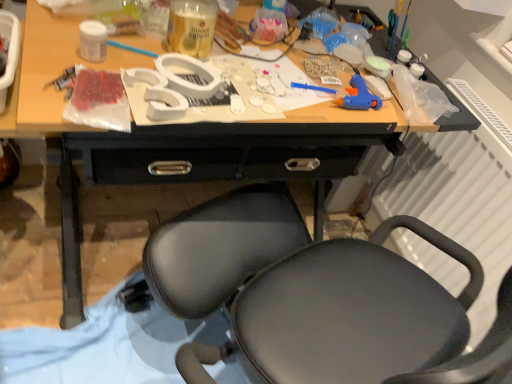
Question: Do you think translucent plastic bottle at upper center, the first bottle in the right-to-left sequence, is within black matte chair at center, or outside of it?

Choices:
 (A) inside
 (B) outside

Answer: (B)

Question: From the image's perspective, relative to black matte chair at center, is translucent plastic bottle at upper center, the first bottle in the right-to-left sequence, above or below?

Choices:
 (A) above
 (B) below

Answer: (A)

Question: Which object is the farthest from the blue plastic glue gun at right?

Choices:
 (A) white plastic radiator at right
 (B) translucent plastic bottle at upper center, positioned as the first bottle in back-to-front order
 (C) black matte chair at center
 (D) translucent glass bottle at center, the second bottle viewed from the right
 (E) white matte jar at upper left, placed as the first bottle when sorted from front to back

Answer: (E)

Question: Which object is the farthest from the black matte chair at center?

Choices:
 (A) blue plastic glue gun at right
 (B) white plastic radiator at right
 (C) translucent glass bottle at center, which appears as the 2th bottle when viewed from the front
 (D) translucent plastic bottle at upper center, the first bottle in the right-to-left sequence
 (E) white matte jar at upper left, placed as the first bottle when sorted from front to back

Answer: (E)